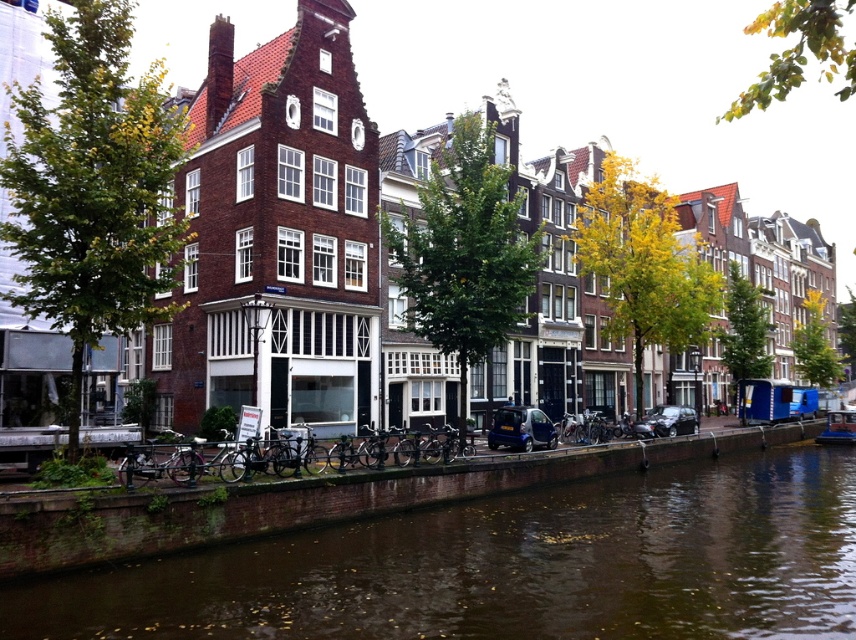
Question: Which of the following is the farthest from the observer?

Choices:
 (A) (821, 538)
 (B) (824, 442)

Answer: (B)

Question: Does brown water at lower center have a lesser width compared to blue plastic boat at right?

Choices:
 (A) yes
 (B) no

Answer: (B)

Question: Is brown water at lower center to the left of blue plastic boat at right from the viewer's perspective?

Choices:
 (A) yes
 (B) no

Answer: (A)

Question: Which point is farther from the camera taking this photo?

Choices:
 (A) (421, 624)
 (B) (841, 438)

Answer: (B)

Question: Is brown water at lower center bigger than blue plastic boat at right?

Choices:
 (A) no
 (B) yes

Answer: (B)

Question: Which point is farther from the camera taking this photo?

Choices:
 (A) (825, 428)
 (B) (556, 493)

Answer: (A)